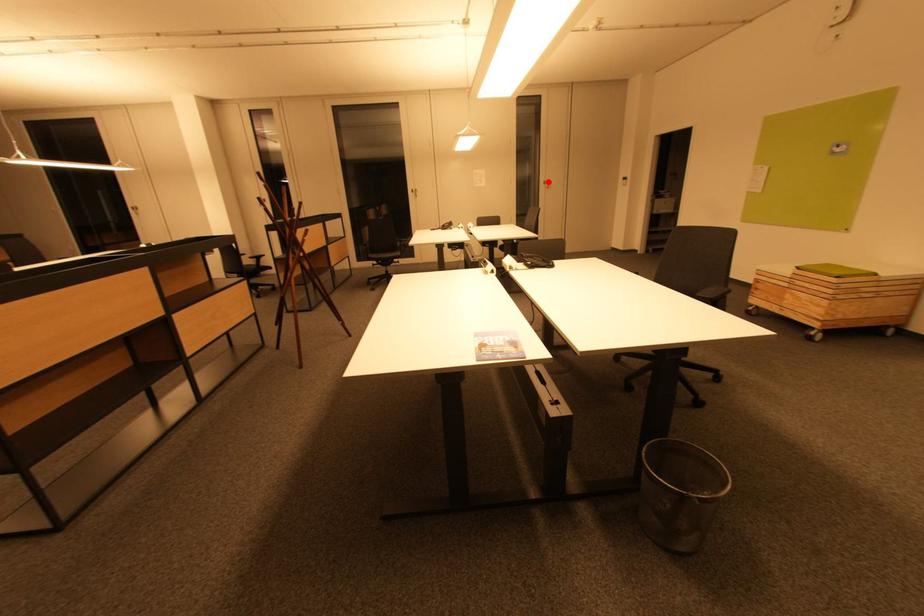
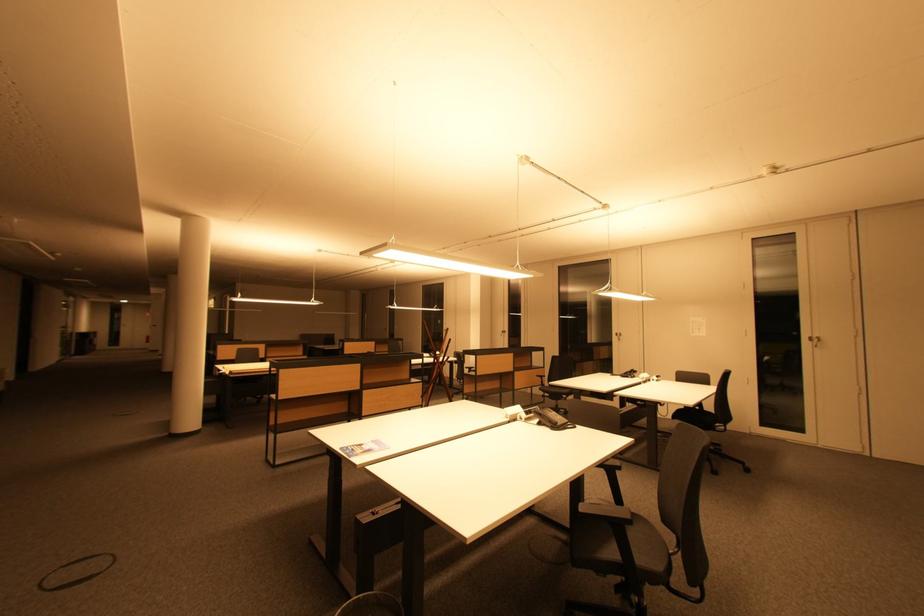
Locate, in the second image, the point that corresponds to the highlighted location in the first image.

(815, 338)